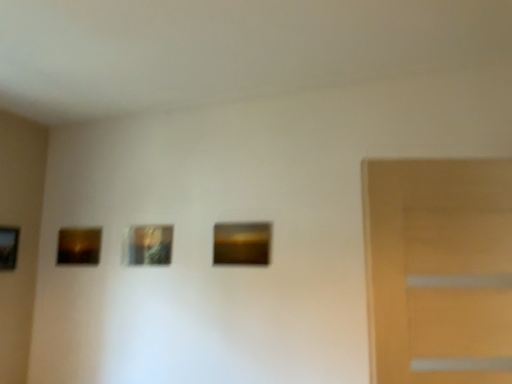
Question: Considering the positions of matte brown picture frame at left, the 3th picture frame positioned from the right, and wooden picture frame at left, which is the fourth picture frame in right-to-left order, in the image, is matte brown picture frame at left, the 3th picture frame positioned from the right, bigger or smaller than wooden picture frame at left, which is the fourth picture frame in right-to-left order,?

Choices:
 (A) small
 (B) big

Answer: (A)

Question: Is matte brown picture frame at left, the 3th picture frame positioned from the right, in front of or behind wooden picture frame at left, which is counted as the first picture frame, starting from the left, in the image?

Choices:
 (A) front
 (B) behind

Answer: (B)

Question: Which is nearer to the matte brown picture frame at center, the first picture frame in the right-to-left sequence?

Choices:
 (A) matte brown picture frame at left, the 3th picture frame positioned from the right
 (B) metallic gold picture frame at center, which is the 2th picture frame in right-to-left order
 (C) wooden picture frame at left, which is counted as the first picture frame, starting from the left

Answer: (B)

Question: Considering the real-world distances, which object is closest to the wooden picture frame at left, which is counted as the first picture frame, starting from the left?

Choices:
 (A) matte brown picture frame at center, which is counted as the 4th picture frame, starting from the left
 (B) metallic gold picture frame at center, arranged as the third picture frame when viewed from the left
 (C) matte brown picture frame at left, which is the second picture frame in left-to-right order

Answer: (C)